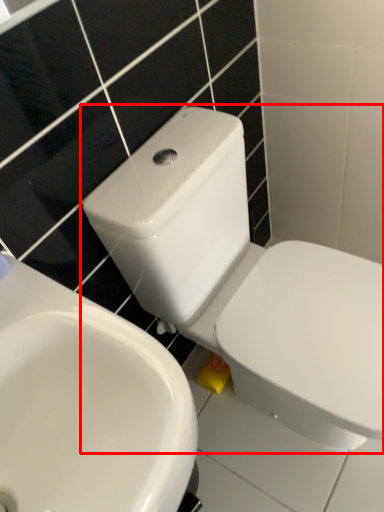
Question: From the image's perspective, what is the correct spatial relationship of toilet (annotated by the red box) in relation to sink?

Choices:
 (A) below
 (B) above

Answer: (B)